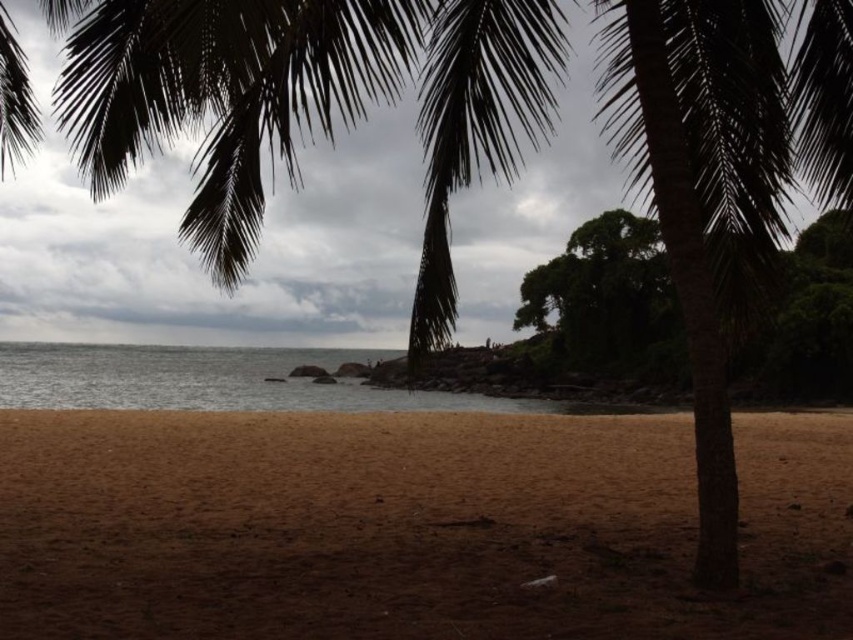
Between brown sandy beach at lower center and green leafy palm tree at center, which one has less height?

Standing shorter between the two is green leafy palm tree at center.

Does point (439, 417) come in front of point (769, 236)?

No, it is behind (769, 236).

Find the location of a particular element. brown sandy beach at lower center is located at coordinates (409, 528).

Is brown sandy beach at lower center positioned in front of green leafy tree at center?

Yes, it is in front of green leafy tree at center.

Is brown sandy beach at lower center above green leafy tree at center?

No.

Is point (489, 593) farther from viewer compared to point (660, 358)?

No, (489, 593) is in front of (660, 358).

You are a GUI agent. You are given a task and a screenshot of the screen. Output one action in this format:
    pyautogui.click(x=<x>, y=<y>)
    Task: Click on the brown sandy beach at lower center
    The image size is (853, 640).
    Given the screenshot: What is the action you would take?
    pyautogui.click(x=409, y=528)

Is green leafy palm tree at center shorter than green leafy tree at center?

Yes.

Is point (746, 108) positioned behind point (647, 248)?

No, it is in front of (647, 248).

Locate an element on the screen. This screenshot has width=853, height=640. green leafy palm tree at center is located at coordinates (703, 193).